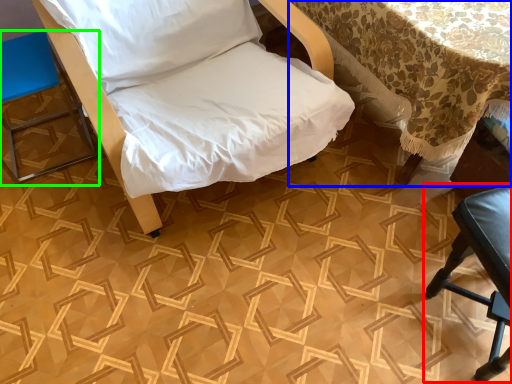
Question: Which object is positioned closest to furniture (highlighted by a red box)? Select from table (highlighted by a blue box) and furniture (highlighted by a green box).

Choices:
 (A) table
 (B) furniture

Answer: (A)